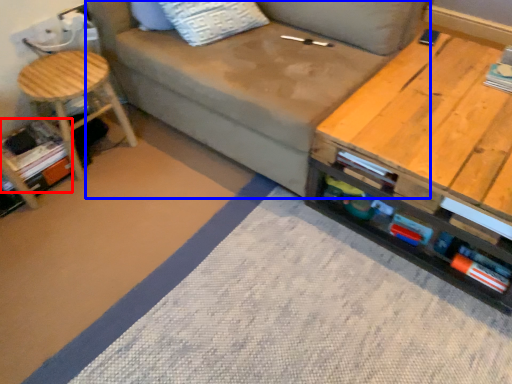
Question: Among these objects, which one is nearest to the camera, book (highlighted by a red box) or studio couch (highlighted by a blue box)?

Choices:
 (A) book
 (B) studio couch

Answer: (B)